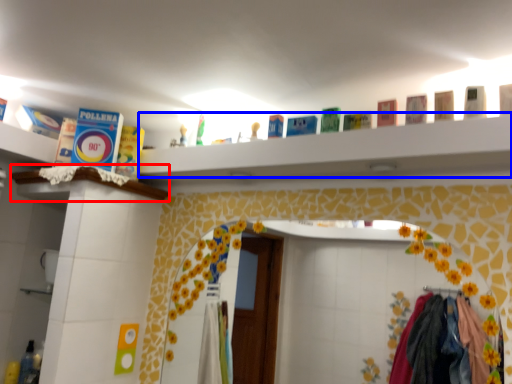
Question: Which point is further to the camera, ledge (highlighted by a red box) or ledge (highlighted by a blue box)?

Choices:
 (A) ledge
 (B) ledge

Answer: (A)